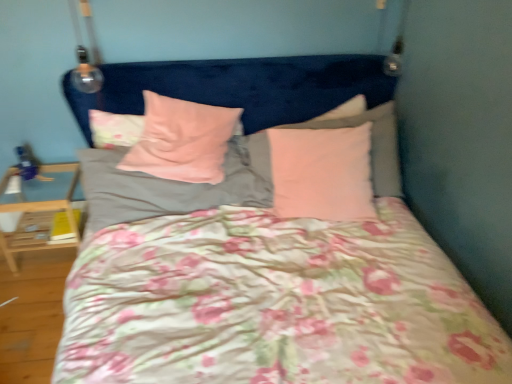
In order to face pink matte pillow at upper right, which ranks as the fourth pillow in left-to-right order, should I rotate leftwards or rightwards?

You should look right and rotate roughly 8.940 degrees.

Where is `pink velvety pillow at center, the third pillow when ordered from right to left`? This screenshot has width=512, height=384. pink velvety pillow at center, the third pillow when ordered from right to left is located at coordinates (182, 140).

Measure the distance between point (188, 181) and camera.

The depth of point (188, 181) is 5.98 feet.

Where is `pink soft fabric pillow at center, positioned as the 2th pillow in left-to-right order`? This screenshot has width=512, height=384. pink soft fabric pillow at center, positioned as the 2th pillow in left-to-right order is located at coordinates (164, 188).

In order to face pink soft fabric pillow at center, positioned as the 2th pillow in left-to-right order, should I rotate leftwards or rightwards?

You should rotate left by 11.046 degrees.

In order to face pink fabric pillow at center, the 1th pillow from the right, should I rotate leftwards or rightwards?

Rotate your view right by about 9.510°.

The image size is (512, 384). What do you see at coordinates (373, 145) in the screenshot? I see `pink fabric pillow at center, the 1th pillow from the right` at bounding box center [373, 145].

The height and width of the screenshot is (384, 512). I want to click on pink matte pillow at upper right, which ranks as the fourth pillow in left-to-right order, so click(x=322, y=173).

Which is behind, point (19, 244) or point (103, 138)?

The point (19, 244) is more distant.

Does light wood/wooden table at lower left have a lesser height compared to floral fabric pillow at upper left, placed as the fifth pillow when sorted from right to left?

In fact, light wood/wooden table at lower left may be taller than floral fabric pillow at upper left, placed as the fifth pillow when sorted from right to left.

Image resolution: width=512 pixels, height=384 pixels. I want to click on table that appears below the floral fabric pillow at upper left, placed as the fifth pillow when sorted from right to left (from a real-world perspective), so click(x=39, y=209).

From the picture: Does light wood/wooden table at lower left touch floral fabric pillow at upper left, placed as the fifth pillow when sorted from right to left?

There is a gap between light wood/wooden table at lower left and floral fabric pillow at upper left, placed as the fifth pillow when sorted from right to left.

Looking at this image, is pink velvety pillow at center, the third pillow when ordered from right to left, in contact with pink matte pillow at upper right, which is the second pillow in right-to-left order?

No, pink velvety pillow at center, the third pillow when ordered from right to left, is not beside pink matte pillow at upper right, which is the second pillow in right-to-left order.

The height and width of the screenshot is (384, 512). Find the location of `the 3rd pillow positioned below the pink velvety pillow at center, the third pillow when ordered from right to left (from a real-world perspective)`. the 3rd pillow positioned below the pink velvety pillow at center, the third pillow when ordered from right to left (from a real-world perspective) is located at coordinates (322, 173).

Which of these two, pink velvety pillow at center, the third pillow when ordered from right to left, or pink matte pillow at upper right, which is the second pillow in right-to-left order, stands shorter?

Standing shorter between the two is pink velvety pillow at center, the third pillow when ordered from right to left.

Does pink fabric pillow at center, the fifth pillow viewed from the left, turn towards pink matte pillow at upper right, which ranks as the fourth pillow in left-to-right order?

Yes, pink fabric pillow at center, the fifth pillow viewed from the left, is turned towards pink matte pillow at upper right, which ranks as the fourth pillow in left-to-right order.

Would you say pink fabric pillow at center, the 1th pillow from the right, is inside or outside pink matte pillow at upper right, which ranks as the fourth pillow in left-to-right order?

pink fabric pillow at center, the 1th pillow from the right, exists entirely within pink matte pillow at upper right, which ranks as the fourth pillow in left-to-right order.

From the image's perspective, is pink fabric pillow at center, the 1th pillow from the right, beneath pink matte pillow at upper right, which is the second pillow in right-to-left order?

No, from the image's perspective, pink fabric pillow at center, the 1th pillow from the right, is not below pink matte pillow at upper right, which is the second pillow in right-to-left order.

In the scene shown: Does pink fabric pillow at center, the 1th pillow from the right, lie in front of pink matte pillow at upper right, which ranks as the fourth pillow in left-to-right order?

No.

From the image's perspective, which one is positioned higher, pink soft fabric pillow at center, positioned as the 2th pillow in left-to-right order, or pink matte pillow at upper right, which is the second pillow in right-to-left order?

pink matte pillow at upper right, which is the second pillow in right-to-left order.

Where is `the 1st pillow above when counting from the pink soft fabric pillow at center, the fourth pillow when ordered from right to left (from the image's perspective)`? The width and height of the screenshot is (512, 384). the 1st pillow above when counting from the pink soft fabric pillow at center, the fourth pillow when ordered from right to left (from the image's perspective) is located at coordinates (322, 173).

From a real-world perspective, is pink soft fabric pillow at center, the fourth pillow when ordered from right to left, on pink matte pillow at upper right, which is the second pillow in right-to-left order?

Actually, pink soft fabric pillow at center, the fourth pillow when ordered from right to left, is physically below pink matte pillow at upper right, which is the second pillow in right-to-left order, in the real world.

Is pink soft fabric pillow at center, positioned as the 2th pillow in left-to-right order, behind pink matte pillow at upper right, which ranks as the fourth pillow in left-to-right order?

No, pink soft fabric pillow at center, positioned as the 2th pillow in left-to-right order, is closer to the viewer.

Between point (379, 131) and point (108, 146), which one is positioned behind?

The point (108, 146) is behind.

Would you say pink fabric pillow at center, the 1th pillow from the right, contains floral fabric pillow at upper left, placed as the fifth pillow when sorted from right to left?

No, floral fabric pillow at upper left, placed as the fifth pillow when sorted from right to left, is not a part of pink fabric pillow at center, the 1th pillow from the right.

Between pink fabric pillow at center, the 1th pillow from the right, and floral fabric pillow at upper left, the first pillow when ordered from left to right, which one has less height?

floral fabric pillow at upper left, the first pillow when ordered from left to right, is shorter.

From a real-world perspective, is floral fabric pillow at upper left, the first pillow when ordered from left to right, beneath pink fabric pillow at center, the 1th pillow from the right?

No, from a real-world perspective, floral fabric pillow at upper left, the first pillow when ordered from left to right, is not below pink fabric pillow at center, the 1th pillow from the right.

Considering the relative positions of floral fabric pillow at upper left, placed as the fifth pillow when sorted from right to left, and pink fabric pillow at center, the 1th pillow from the right, in the image provided, is floral fabric pillow at upper left, placed as the fifth pillow when sorted from right to left, behind pink fabric pillow at center, the 1th pillow from the right,?

Yes, it is behind pink fabric pillow at center, the 1th pillow from the right.

Who is bigger, floral fabric pillow at upper left, placed as the fifth pillow when sorted from right to left, or pink fabric pillow at center, the fifth pillow viewed from the left?

pink fabric pillow at center, the fifth pillow viewed from the left.

Locate an element on the screen. The width and height of the screenshot is (512, 384). pillow that is the 2nd one when counting rightward from the floral fabric pillow at upper left, placed as the fifth pillow when sorted from right to left is located at coordinates (182, 140).

Is pink velvety pillow at center, positioned as the 3th pillow in left-to-right order, positioned with its back to floral fabric pillow at upper left, the first pillow when ordered from left to right?

That's not correct — pink velvety pillow at center, positioned as the 3th pillow in left-to-right order, is not looking away from floral fabric pillow at upper left, the first pillow when ordered from left to right.

Considering the relative positions of pink velvety pillow at center, positioned as the 3th pillow in left-to-right order, and floral fabric pillow at upper left, the first pillow when ordered from left to right, in the image provided, is pink velvety pillow at center, positioned as the 3th pillow in left-to-right order, to the left of floral fabric pillow at upper left, the first pillow when ordered from left to right, from the viewer's perspective?

Incorrect, pink velvety pillow at center, positioned as the 3th pillow in left-to-right order, is not on the left side of floral fabric pillow at upper left, the first pillow when ordered from left to right.

From a real-world perspective, which is physically below, pink velvety pillow at center, the third pillow when ordered from right to left, or floral fabric pillow at upper left, placed as the fifth pillow when sorted from right to left?

In real-world perspective, floral fabric pillow at upper left, placed as the fifth pillow when sorted from right to left, is lower.

I want to click on the 1st pillow in front of the light wood/wooden table at lower left, so pyautogui.click(x=115, y=129).

Image resolution: width=512 pixels, height=384 pixels. I want to click on the 2nd pillow below when counting from the pink velvety pillow at center, the third pillow when ordered from right to left (from the image's perspective), so click(x=322, y=173).

Consider the image. Based on their spatial positions, is pink fabric pillow at center, the 1th pillow from the right, or floral fabric pillow at upper left, placed as the fifth pillow when sorted from right to left, further from light wood/wooden table at lower left?

Among the two, pink fabric pillow at center, the 1th pillow from the right, is located further to light wood/wooden table at lower left.

Based on their spatial positions, is pink soft fabric pillow at center, positioned as the 2th pillow in left-to-right order, or light wood/wooden table at lower left further from pink velvety pillow at center, the third pillow when ordered from right to left?

Among the two, light wood/wooden table at lower left is located further to pink velvety pillow at center, the third pillow when ordered from right to left.

Based on the photo, looking at the image, which one is located closer to pink soft fabric pillow at center, positioned as the 2th pillow in left-to-right order, floral fabric pillow at upper left, placed as the fifth pillow when sorted from right to left, or light wood/wooden table at lower left?

floral fabric pillow at upper left, placed as the fifth pillow when sorted from right to left, is positioned closer to the anchor pink soft fabric pillow at center, positioned as the 2th pillow in left-to-right order.

Which object lies further to the anchor point pink fabric pillow at center, the 1th pillow from the right, pink soft fabric pillow at center, the fourth pillow when ordered from right to left, or light wood/wooden table at lower left?

Among the two, light wood/wooden table at lower left is located further to pink fabric pillow at center, the 1th pillow from the right.

Considering their positions, is pink soft fabric pillow at center, positioned as the 2th pillow in left-to-right order, positioned further to pink fabric pillow at center, the 1th pillow from the right, than pink velvety pillow at center, positioned as the 3th pillow in left-to-right order?

pink velvety pillow at center, positioned as the 3th pillow in left-to-right order, is further to pink fabric pillow at center, the 1th pillow from the right.

Based on their spatial positions, is floral fabric pillow at upper left, the first pillow when ordered from left to right, or pink matte pillow at upper right, which ranks as the fourth pillow in left-to-right order, closer to pink fabric pillow at center, the fifth pillow viewed from the left?

The object closer to pink fabric pillow at center, the fifth pillow viewed from the left, is pink matte pillow at upper right, which ranks as the fourth pillow in left-to-right order.

Looking at the image, which one is located closer to light wood/wooden table at lower left, pink soft fabric pillow at center, positioned as the 2th pillow in left-to-right order, or pink fabric pillow at center, the fifth pillow viewed from the left?

pink soft fabric pillow at center, positioned as the 2th pillow in left-to-right order, lies closer to light wood/wooden table at lower left than the other object.

Based on their spatial positions, is pink velvety pillow at center, the third pillow when ordered from right to left, or pink matte pillow at upper right, which is the second pillow in right-to-left order, closer to light wood/wooden table at lower left?

pink velvety pillow at center, the third pillow when ordered from right to left, is positioned closer to the anchor light wood/wooden table at lower left.

Locate an element on the screen. This screenshot has width=512, height=384. pillow between pink soft fabric pillow at center, positioned as the 2th pillow in left-to-right order, and pink matte pillow at upper right, which ranks as the fourth pillow in left-to-right order, from left to right is located at coordinates (182, 140).

You are a GUI agent. You are given a task and a screenshot of the screen. Output one action in this format:
    pyautogui.click(x=<x>, y=<y>)
    Task: Click on the pillow between floral fabric pillow at upper left, placed as the fifth pillow when sorted from right to left, and pink velvety pillow at center, the third pillow when ordered from right to left
    The width and height of the screenshot is (512, 384).
    Given the screenshot: What is the action you would take?
    pyautogui.click(x=164, y=188)

Where is `pillow situated between light wood/wooden table at lower left and pink soft fabric pillow at center, the fourth pillow when ordered from right to left, from left to right`? The height and width of the screenshot is (384, 512). pillow situated between light wood/wooden table at lower left and pink soft fabric pillow at center, the fourth pillow when ordered from right to left, from left to right is located at coordinates (115, 129).

Locate an element on the screen. The image size is (512, 384). pillow between pink velvety pillow at center, positioned as the 3th pillow in left-to-right order, and pink fabric pillow at center, the 1th pillow from the right is located at coordinates (322, 173).